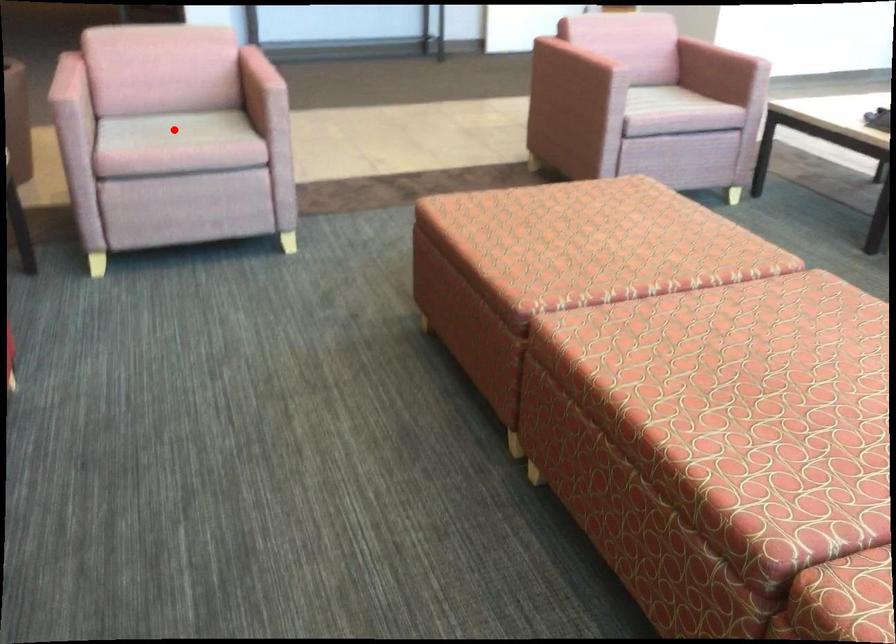
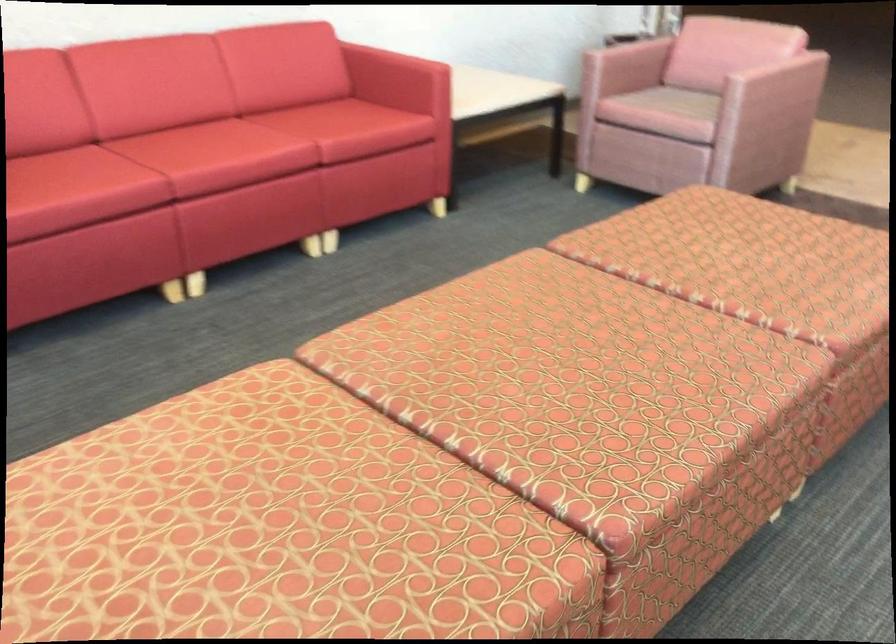
Where in the second image is the point corresponding to the highlighted location from the first image?

(686, 102)